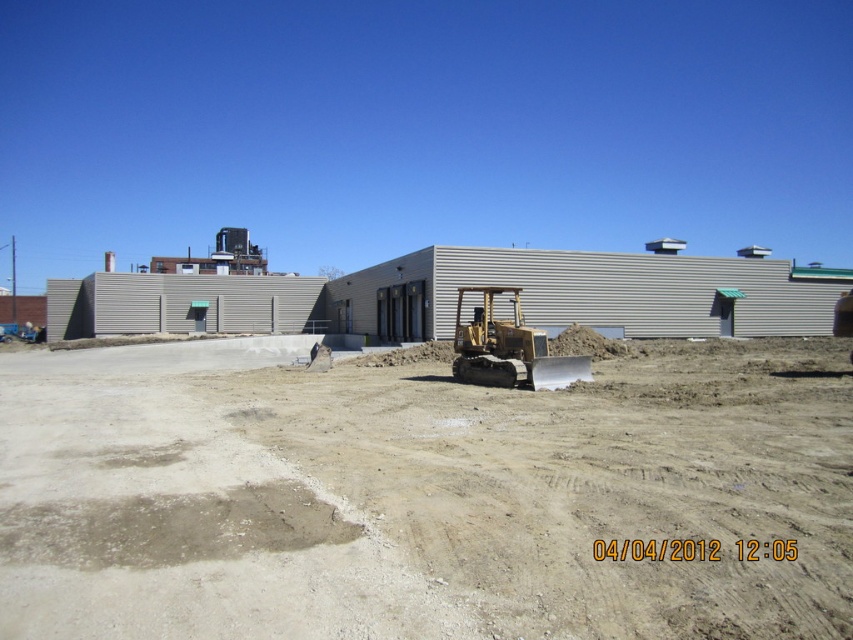
You are a construction worker who needs to transport a 3m wide container across the site. The path you want to take goes through the area between the brown sandy dirt at center and the gold metallic excavator at center. Can the container pass through this path?

The brown sandy dirt at center is wider than the gold metallic excavator at center. Since the container is 3m wide, the path between them must be at least 3m. However, without knowing the exact width of the path, we cannot confirm if it is sufficient. The description only states the dirt is wider than the excavator, but not the actual measurements needed.

You are a construction worker standing at the edge of the construction site. You need to walk from your current position to the gold metallic excavator at center. Is the brown sandy dirt at center in your path?

Yes, the brown sandy dirt at center is in your path because it is closer to the viewer than the gold metallic excavator at center, meaning you would have to walk over the brown sandy dirt at center to reach the gold metallic excavator at center.